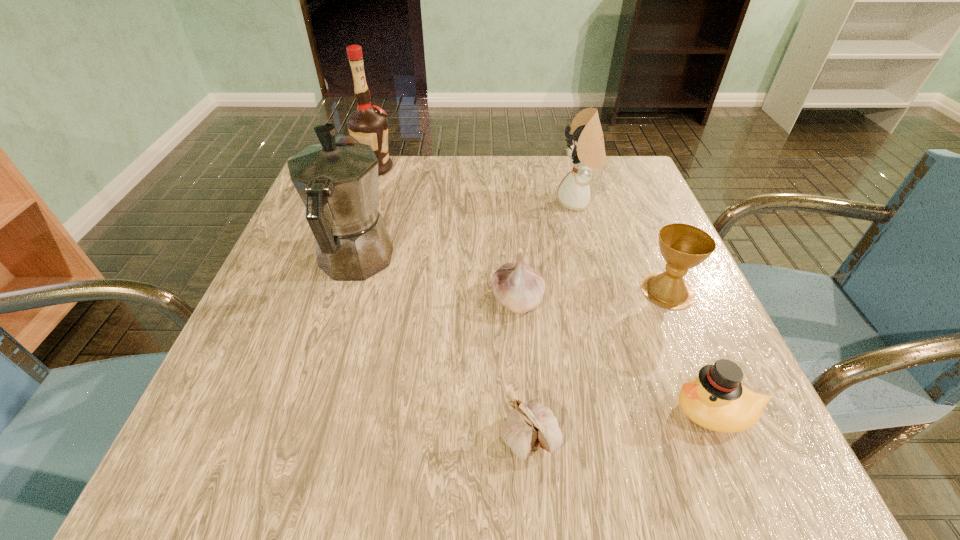
Identify the location of object that is at the far left corner. (368, 124).

Where is `object that is at the far right corner`? object that is at the far right corner is located at coordinates (586, 149).

Find the location of `object at the near right corner`. object at the near right corner is located at coordinates (716, 400).

In order to click on free region at the far edge in this screenshot , I will do `click(530, 170)`.

Where is `free space at the near edge of the desktop`? free space at the near edge of the desktop is located at coordinates (341, 469).

This screenshot has width=960, height=540. Identify the location of vacant space at the left edge of the desktop. (263, 292).

Identify the location of vacant space at the right edge. (617, 268).

Find the location of `vacant space at the near right corner`. vacant space at the near right corner is located at coordinates (708, 487).

Where is `free space between the coffeepot and the fifth shortest object`? free space between the coffeepot and the fifth shortest object is located at coordinates (466, 232).

At what (x,y) coordinates should I click in order to perform the action: click on vacant area between the chalice and the shorter garlic. Please return your answer as a coordinate pair (x, y). Image resolution: width=960 pixels, height=540 pixels. Looking at the image, I should click on (599, 364).